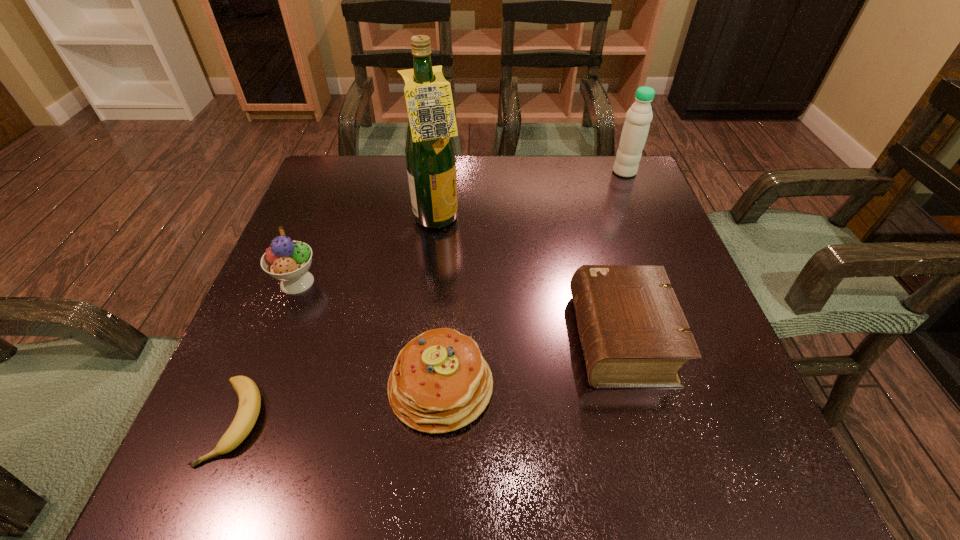
Locate an element on the screen. This screenshot has height=540, width=960. vacant region at the near left corner is located at coordinates (244, 490).

Locate an element on the screen. The height and width of the screenshot is (540, 960). vacant position at the near right corner of the desktop is located at coordinates [740, 489].

Locate an element on the screen. free space between the pancake and the water bottle is located at coordinates (533, 279).

Where is `free spot between the water bottle and the third tallest object`? free spot between the water bottle and the third tallest object is located at coordinates (461, 227).

Image resolution: width=960 pixels, height=540 pixels. I want to click on free space between the fifth object from left to right and the third tallest object, so click(459, 310).

Locate an element on the screen. vacant area that lies between the banana and the third tallest object is located at coordinates (267, 352).

Identify the location of empty space between the fourth shortest object and the pancake. (369, 334).

Where is `free space that is in between the tallest object and the rightmost object`? free space that is in between the tallest object and the rightmost object is located at coordinates (531, 197).

The image size is (960, 540). I want to click on free space that is in between the banana and the third tallest object, so click(x=267, y=352).

Identify the location of blank region between the third tallest object and the banana. (267, 352).